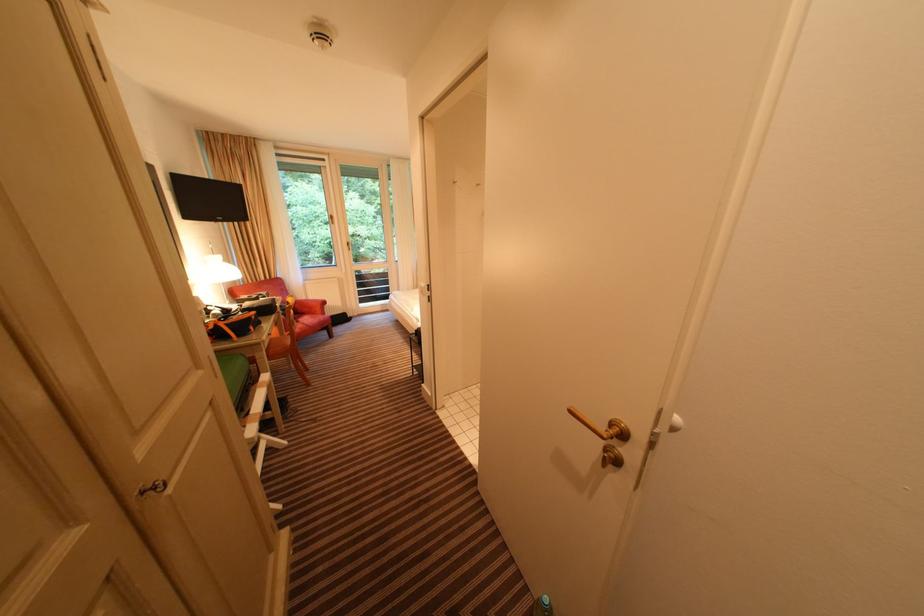
Where is `green glass bottle`? green glass bottle is located at coordinates (542, 606).